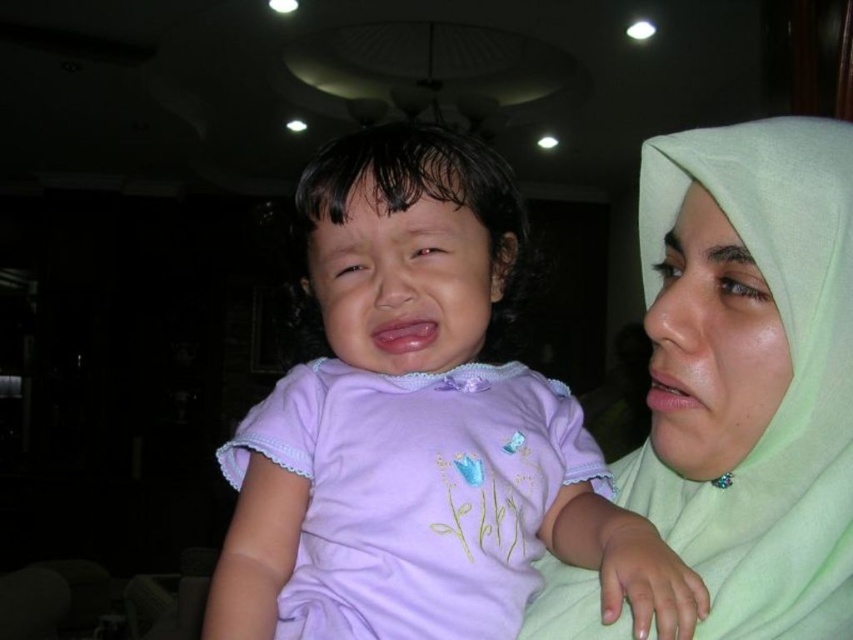
Question: Observing the image, what is the correct spatial positioning of purple soft fabric shirt at center in reference to light green fabric at upper right?

Choices:
 (A) left
 (B) right

Answer: (A)

Question: Is purple soft fabric shirt at center to the right of light green fabric at upper right from the viewer's perspective?

Choices:
 (A) no
 (B) yes

Answer: (A)

Question: Is purple soft fabric shirt at center below light green fabric at upper right?

Choices:
 (A) yes
 (B) no

Answer: (B)